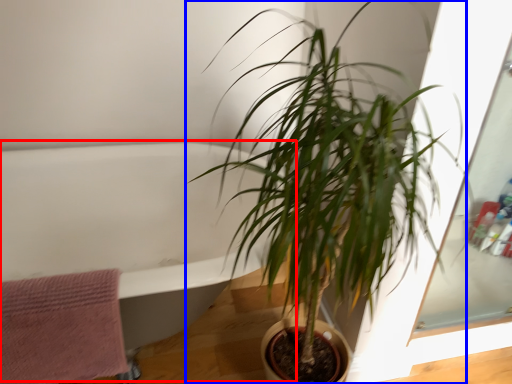
Question: Which object appears farthest to the camera in this image, bath (highlighted by a red box) or houseplant (highlighted by a blue box)?

Choices:
 (A) bath
 (B) houseplant

Answer: (A)